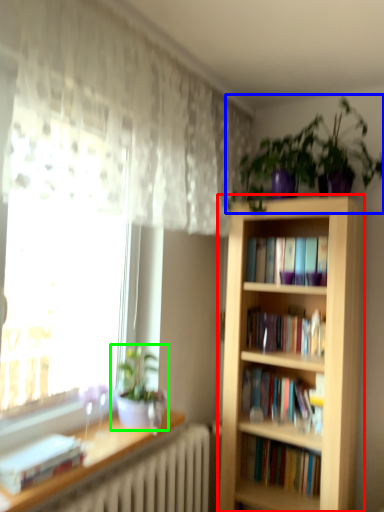
Question: Which object is the farthest from bookcase (highlighted by a red box)? Choose among these: houseplant (highlighted by a blue box) or houseplant (highlighted by a green box).

Choices:
 (A) houseplant
 (B) houseplant

Answer: (B)